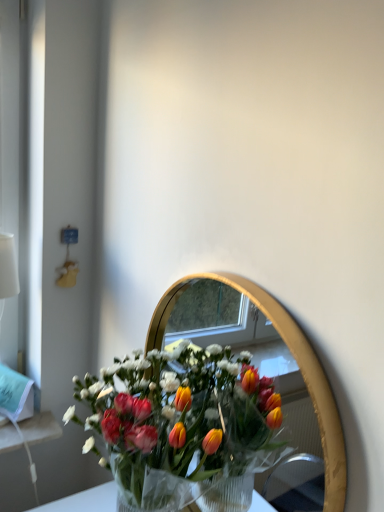
Question: From the image's perspective, is translucent plastic bouquet at center above or below gold metallic mirror at center?

Choices:
 (A) above
 (B) below

Answer: (B)

Question: Do you think translucent plastic bouquet at center is within gold metallic mirror at center, or outside of it?

Choices:
 (A) outside
 (B) inside

Answer: (A)

Question: In the image, is translucent plastic bouquet at center on the left side or the right side of gold metallic mirror at center?

Choices:
 (A) right
 (B) left

Answer: (B)

Question: In the image, is gold metallic mirror at center on the left side or the right side of translucent plastic bouquet at center?

Choices:
 (A) right
 (B) left

Answer: (A)

Question: Is gold metallic mirror at center in front of or behind translucent plastic bouquet at center in the image?

Choices:
 (A) front
 (B) behind

Answer: (A)

Question: Do you think gold metallic mirror at center is within translucent plastic bouquet at center, or outside of it?

Choices:
 (A) inside
 (B) outside

Answer: (B)

Question: From the image's perspective, relative to translucent plastic bouquet at center, is gold metallic mirror at center above or below?

Choices:
 (A) below
 (B) above

Answer: (B)